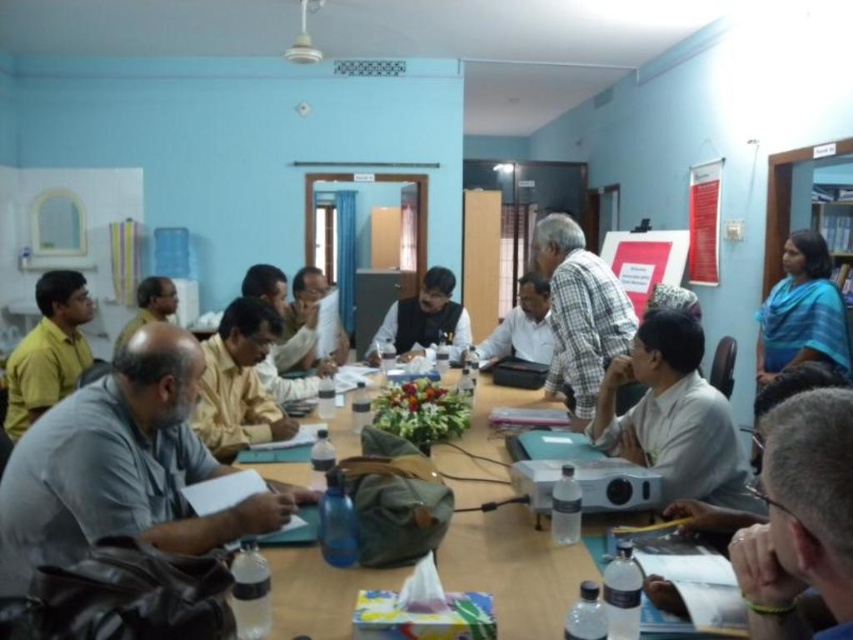
You are a photographer standing behind the long wooden table in the meeting room. You want to take a photo that includes both the yellow matte shirt at left and the white shirt at center. Which shirt should you adjust to ensure both are fully visible in the frame?

The yellow matte shirt at left is much taller than the white shirt at center. To ensure both are fully visible, you should lower the angle of the camera or adjust the position to include the taller yellow matte shirt at left without cropping it, while the shorter white shirt at center will naturally be in frame.

You are sitting at the long wooden table in the meeting room. You need to pass a document to the person wearing the checkered fabric shirt at center. Which direction should you pass it to relative to the person wearing the yellow matte shirt at left?

The checkered fabric shirt at center is to the right of the yellow matte shirt at left, so you should pass the document to the right relative to the person wearing the yellow matte shirt at left.